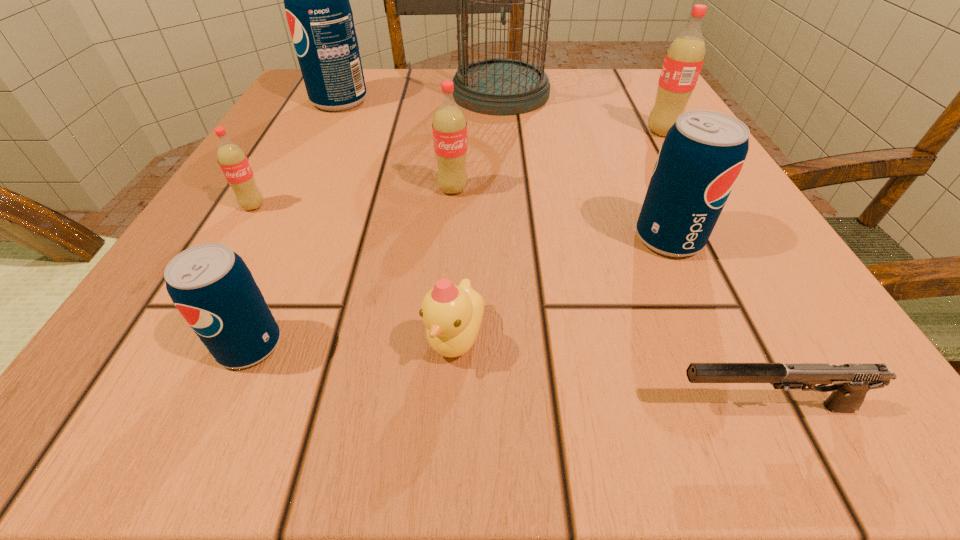
Locate an element on the screen. pop located at the far edge is located at coordinates (319, 15).

This screenshot has height=540, width=960. In order to click on pop that is at the near edge in this screenshot , I will do coord(211,286).

Find the location of a particular element. duckling at the near edge is located at coordinates (452, 314).

Find the location of `gun present at the near edge`. gun present at the near edge is located at coordinates (851, 382).

Where is `gun located at the right edge`? This screenshot has height=540, width=960. gun located at the right edge is located at coordinates (851, 382).

Where is `object that is at the far left corner`? object that is at the far left corner is located at coordinates (319, 15).

The width and height of the screenshot is (960, 540). I want to click on object that is at the near left corner, so click(211, 286).

This screenshot has height=540, width=960. In order to click on object that is at the near right corner in this screenshot , I will do `click(851, 382)`.

You are a GUI agent. You are given a task and a screenshot of the screen. Output one action in this format:
    pyautogui.click(x=<x>, y=<y>)
    Task: Click on the vacant space at the far edge of the desktop
    This screenshot has width=960, height=540.
    Given the screenshot: What is the action you would take?
    pyautogui.click(x=476, y=117)

In the image, there is a desktop. What are the coordinates of `vacant area at the near edge` in the screenshot? It's located at (646, 346).